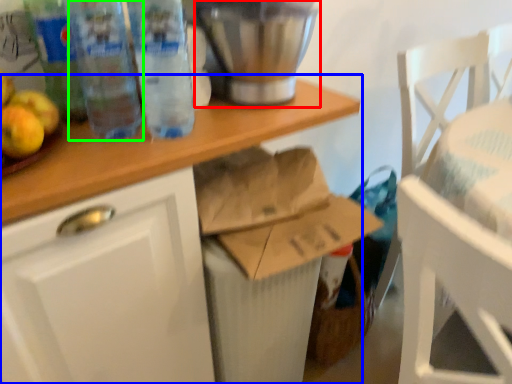
Question: Which object is the closest to the appliance (highlighted by a red box)? Choose among these: desk (highlighted by a blue box) or bottle (highlighted by a green box).

Choices:
 (A) desk
 (B) bottle

Answer: (A)